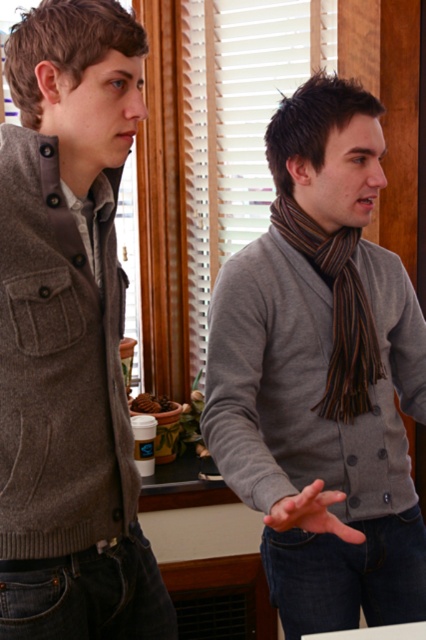
You are standing in the room and want to place a new decorative item at the exact center of the room. The gray wool sweater at center is currently at point 0.588, 0.756. Is the sweater already positioned at the center of the room?

The gray wool sweater at center is located at point (322, 376), which indicates it is already positioned at the center of the room.

You are standing in the room where the two people are talking. You want to take a photo of the point at coordinate point (46, 600) and point (319, 404). Which point will appear larger in your photo?

Point (46, 600) is closer to the camera than point (319, 404), so it will appear larger in the photo.

You are standing in the room where the two people are talking. You need to move from point A at point (264, 532) to point B at point (25, 353). Which direction should you move to get closer to point B?

To move from point A at point (264, 532) to point B at point (25, 353), you should move downward and to the left since point B is lower and further to the left compared to point A.